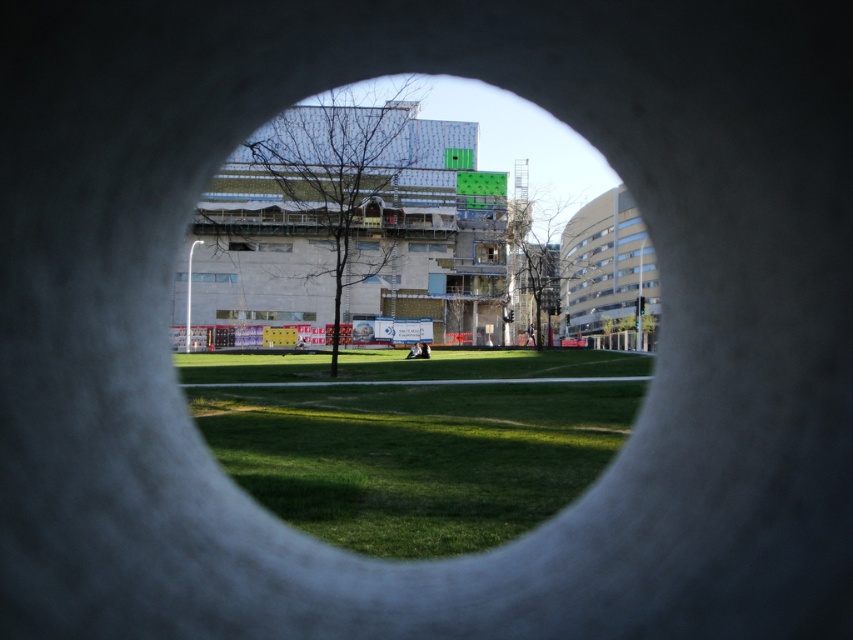
Question: Which point is farther from the camera taking this photo?

Choices:
 (A) (187, 372)
 (B) (331, 380)

Answer: (A)

Question: Does white concrete hole at center lie in front of green grass at center?

Choices:
 (A) yes
 (B) no

Answer: (B)

Question: Is white concrete hole at center wider than green grass at center?

Choices:
 (A) yes
 (B) no

Answer: (A)

Question: Which point is closer to the camera?

Choices:
 (A) (648, 268)
 (B) (328, 486)

Answer: (B)

Question: Does white concrete hole at center lie in front of green grass at center?

Choices:
 (A) no
 (B) yes

Answer: (A)

Question: Which of the following is the farthest from the observer?

Choices:
 (A) (474, 211)
 (B) (486, 352)

Answer: (A)